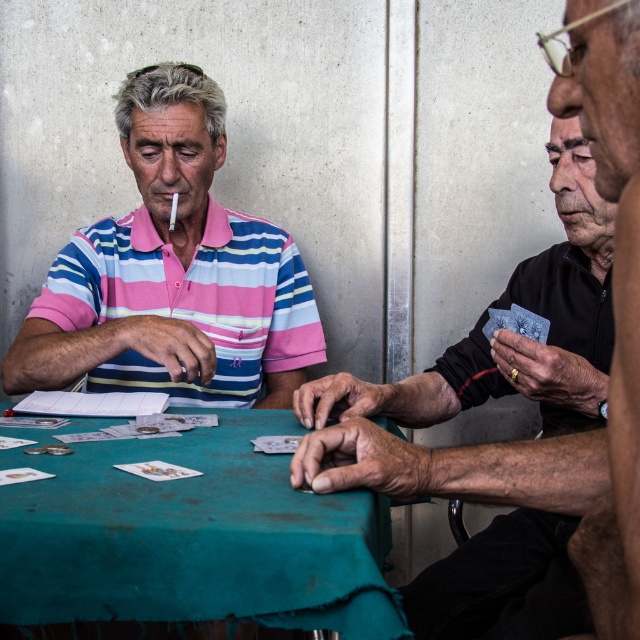
Does green fabric table at center have a greater height compared to matte striped polo shirt at left?

No, green fabric table at center is not taller than matte striped polo shirt at left.

Who is lower down, green fabric table at center or matte striped polo shirt at left?

green fabric table at center is below.

Is point (29, 484) behind point (156, 68)?

No, (29, 484) is closer to viewer.

The width and height of the screenshot is (640, 640). I want to click on green fabric table at center, so click(x=193, y=538).

Is matte black shirt at right above black matte card at right?

No, matte black shirt at right is not above black matte card at right.

Which is in front, point (560, 557) or point (634, 97)?

Point (634, 97) is in front.

Is point (300, 397) positioned behind point (586, 20)?

Yes, it is.

Locate an element on the screen. matte black shirt at right is located at coordinates (493, 445).

Does green fabric table at center have a lesser height compared to black matte card at right?

Indeed, green fabric table at center has a lesser height compared to black matte card at right.

Which of these two, green fabric table at center or black matte card at right, stands shorter?

Standing shorter between the two is green fabric table at center.

Is point (211, 529) behind point (634, 250)?

Yes, point (211, 529) is behind point (634, 250).

Find the location of a particular element. green fabric table at center is located at coordinates (193, 538).